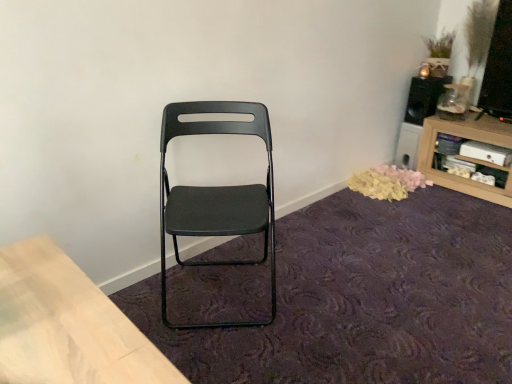
You are a GUI agent. You are given a task and a screenshot of the screen. Output one action in this format:
    pyautogui.click(x=<x>, y=<y>)
    Task: Click on the free space behind matte black folding chair at center
    
    Given the screenshot: What is the action you would take?
    pyautogui.click(x=250, y=246)